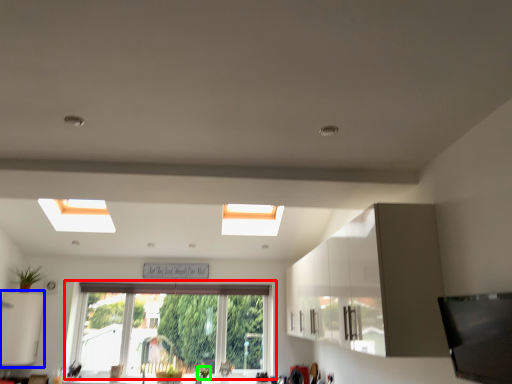
Question: Considering the real-world distances, which object is closest to window (highlighted by a red box)? cabinetry (highlighted by a blue box) or plant (highlighted by a green box).

Choices:
 (A) cabinetry
 (B) plant

Answer: (B)